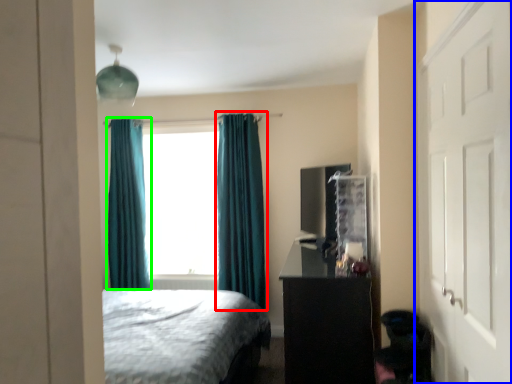
Question: Based on their relative distances, which object is nearer to curtain (highlighted by a red box)? Choose from door (highlighted by a blue box) and curtain (highlighted by a green box).

Choices:
 (A) door
 (B) curtain

Answer: (B)